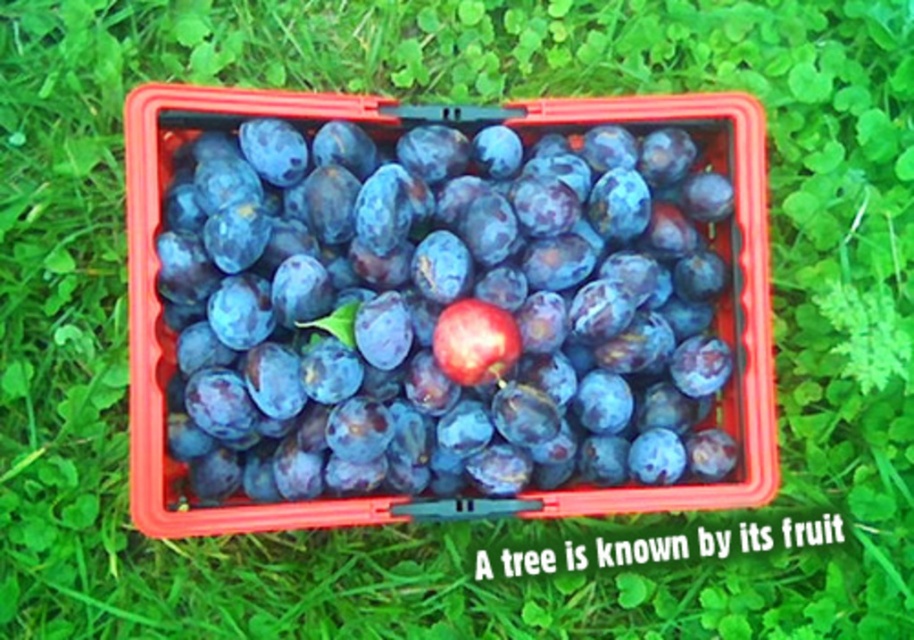
Can you confirm if shiny purple plum at center is taller than shiny red plum at center?

Correct, shiny purple plum at center is much taller as shiny red plum at center.

Is point (368, 440) farther from camera compared to point (487, 360)?

Yes, it is.

The width and height of the screenshot is (914, 640). What are the coordinates of `shiny purple plum at center` in the screenshot? It's located at (439, 310).